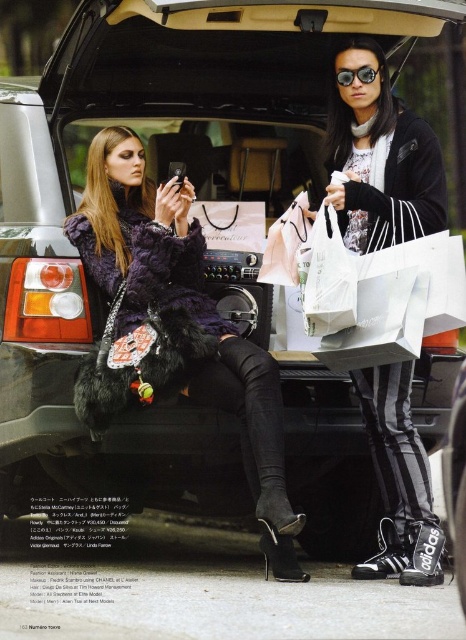
You are a photographer trying to capture a candid shot of the two people in the SUV trunk. You want to ensure that both the black adidas sneakers at lower right and the matte black goggles at upper center are clearly visible in the frame. Based on their positions, which object should you prioritize framing closer to the right side of the photo?

The black adidas sneakers at lower right should be framed closer to the right side of the photo since they are positioned to the right of the matte black goggles at upper center.

You are a delivery robot with a width of 1.2 meters. You need to navigate through the space between the black adidas sneakers at lower right and the matte black goggles at upper center. Can you fit through this space without tilting sideways?

The distance between the black adidas sneakers at lower right and the matte black goggles at upper center is 1.55 meters. Since your width is 1.2 meters, you can fit through the space without tilting sideways as there is enough clearance.